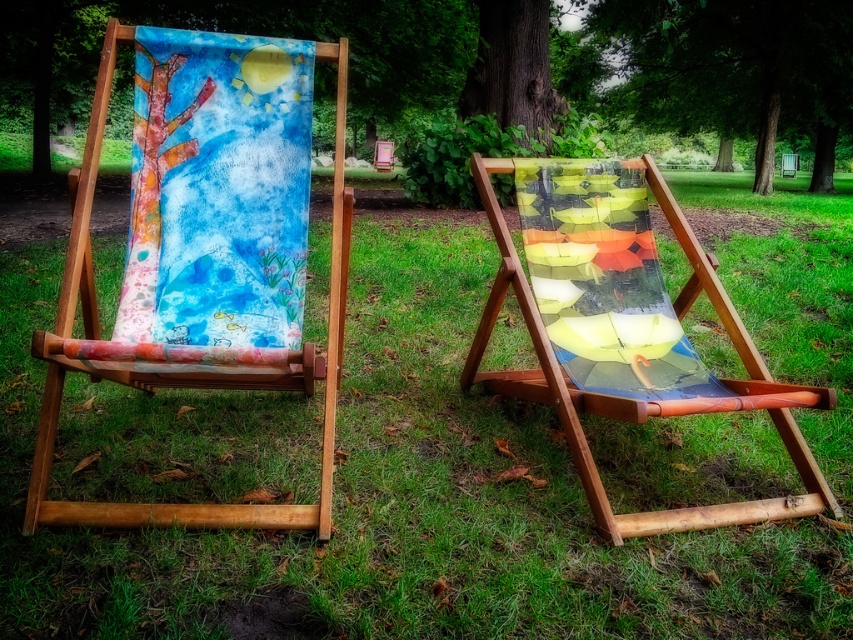
Can you confirm if green grass at center is thinner than smooth bark tree at center?

In fact, green grass at center might be wider than smooth bark tree at center.

Which is in front, point (509, 422) or point (461, 100)?

Point (509, 422)

Where is `green grass at center`? The width and height of the screenshot is (853, 640). green grass at center is located at coordinates (399, 500).

Between point (264, 212) and point (548, 141), which one is positioned behind?

Point (548, 141)

Is matte fabric beach chair at left to the left of smooth bark tree at center from the viewer's perspective?

Correct, you'll find matte fabric beach chair at left to the left of smooth bark tree at center.

Between point (177, 113) and point (494, 100), which one is positioned in front?

Point (177, 113) is in front.

Where is `matte fabric beach chair at left`? matte fabric beach chair at left is located at coordinates (202, 250).

Is point (236, 632) less distant than point (840, 36)?

Yes, point (236, 632) is in front of point (840, 36).

Between green grass at center and watercolor canvas at upper center, which one has more height?

With more height is watercolor canvas at upper center.

Is point (469, 474) in front of point (374, 106)?

Yes, it is.

This screenshot has width=853, height=640. What are the coordinates of `green grass at center` in the screenshot? It's located at (399, 500).